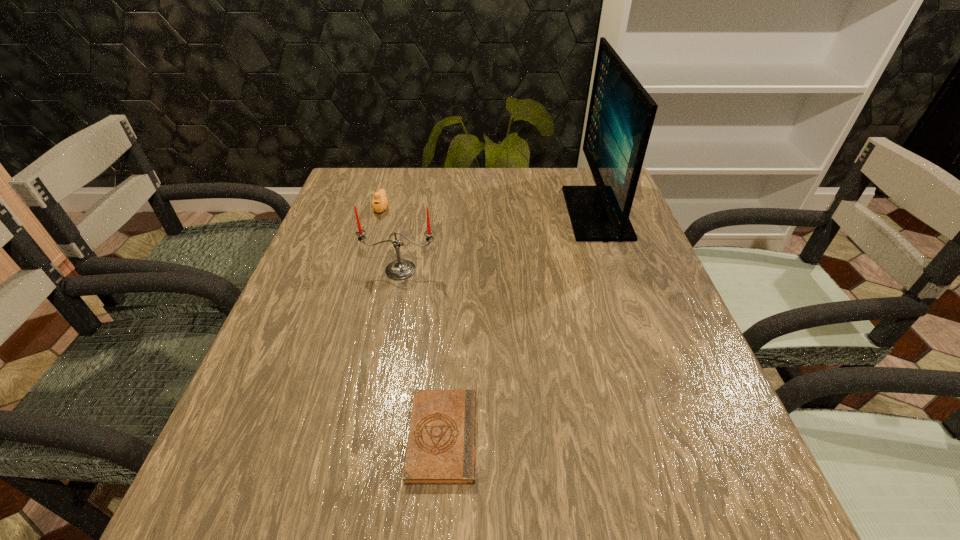
Locate an element on the screen. unoccupied position between the third shortest object and the rightmost object is located at coordinates (498, 241).

The height and width of the screenshot is (540, 960). Find the location of `vacant space that's between the candle and the rightmost object`. vacant space that's between the candle and the rightmost object is located at coordinates click(x=498, y=241).

In order to click on empty space that is in between the candle and the nearest object in this screenshot , I will do [x=421, y=353].

Locate an element on the screen. Image resolution: width=960 pixels, height=540 pixels. free space between the rightmost object and the diary is located at coordinates (519, 325).

The height and width of the screenshot is (540, 960). I want to click on vacant area that lies between the nearest object and the candle, so click(x=421, y=353).

This screenshot has width=960, height=540. Identify the location of object that is the second closest to the second shortest object. (621, 114).

At what (x,y) coordinates should I click in order to perform the action: click on object that ranks as the closest to the shortest object. Please return your answer as a coordinate pair (x, y). The image size is (960, 540). Looking at the image, I should click on [x=400, y=269].

The height and width of the screenshot is (540, 960). Find the location of `vacant area that satisfies the following two spatial constraints: 1. on the screen side of the tallest object; 2. on the front-facing side of the third shortest object`. vacant area that satisfies the following two spatial constraints: 1. on the screen side of the tallest object; 2. on the front-facing side of the third shortest object is located at coordinates (616, 270).

At what (x,y) coordinates should I click in order to perform the action: click on blank area in the image that satisfies the following two spatial constraints: 1. on the screen side of the rightmost object; 2. on the front-facing side of the candle. Please return your answer as a coordinate pair (x, y). This screenshot has height=540, width=960. Looking at the image, I should click on (616, 270).

Where is `blank space that satisfies the following two spatial constraints: 1. on the screen side of the tallest object; 2. on the front-facing side of the second tallest object`? The width and height of the screenshot is (960, 540). blank space that satisfies the following two spatial constraints: 1. on the screen side of the tallest object; 2. on the front-facing side of the second tallest object is located at coordinates (616, 270).